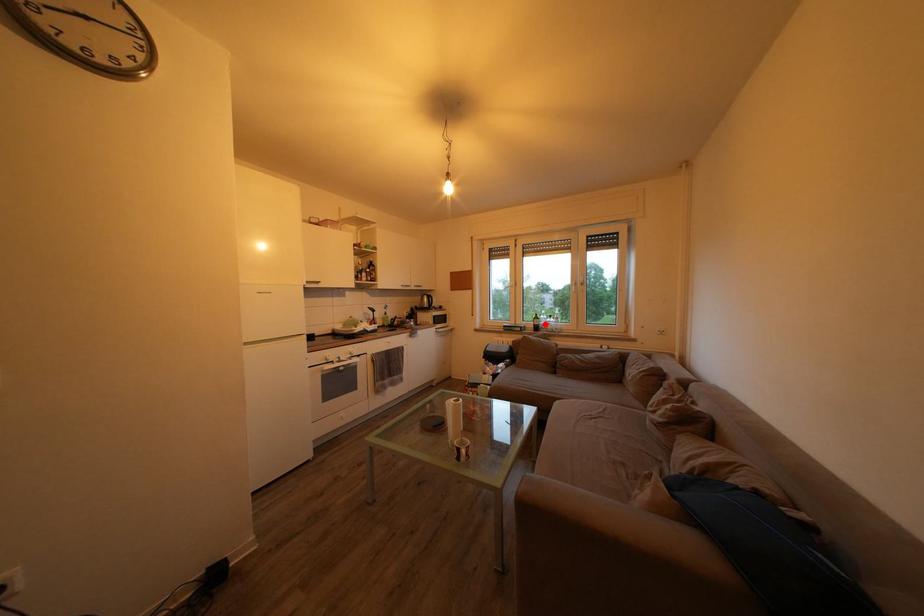
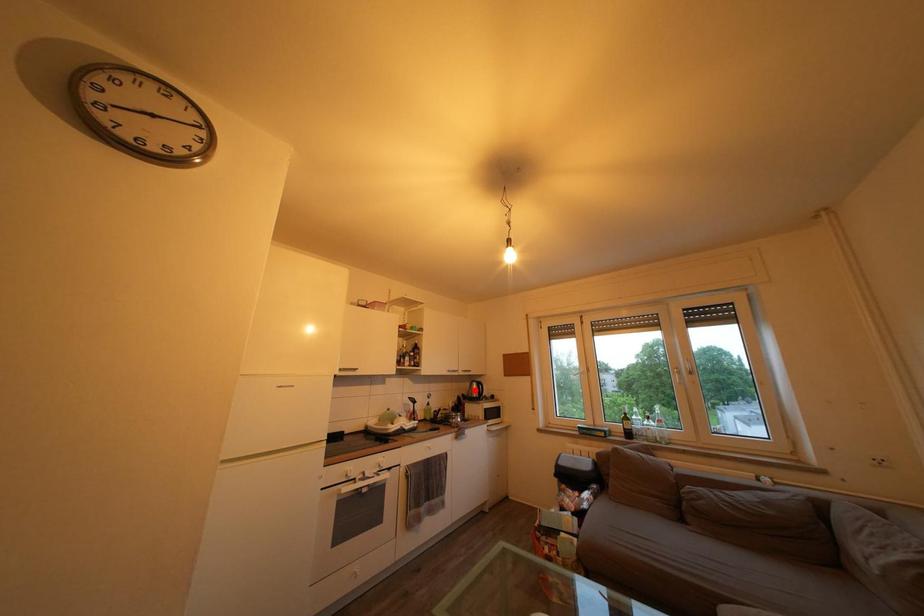
I am providing you with two images of the same scene from different viewpoints. A red point is marked on the first image and another point is marked on the second image. Does the point marked in image1 correspond to the same location as the one in image2?

No